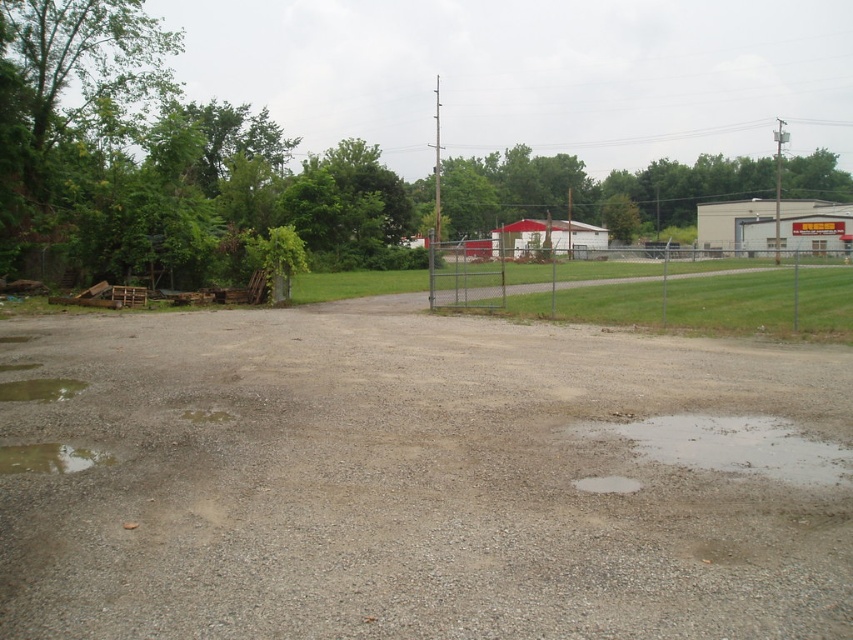
Question: Is metallic chain-link fence at center-right smaller than transparent water at lower left?

Choices:
 (A) no
 (B) yes

Answer: (A)

Question: From the image, what is the correct spatial relationship of transparent wet gravel at lower left in relation to white matte puddle at center?

Choices:
 (A) right
 (B) left

Answer: (B)

Question: Does metallic chain-link fence at center-right have a lesser width compared to transparent water at lower left?

Choices:
 (A) yes
 (B) no

Answer: (B)

Question: Which point appears farthest from the camera in this image?

Choices:
 (A) (601, 481)
 (B) (50, 451)
 (C) (844, 264)
 (D) (198, 579)

Answer: (C)

Question: Which object is closer to the camera taking this photo?

Choices:
 (A) white matte puddle at center
 (B) transparent wet gravel at lower left
 (C) metallic chain-link fence at center-right

Answer: (A)

Question: Considering the real-world distances, which object is farthest from the transparent water at lower left?

Choices:
 (A) clear water at lower right
 (B) transparent wet gravel at lower left

Answer: (A)